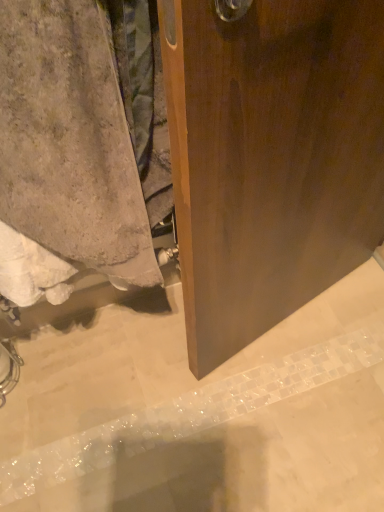
Question: Considering the positions of point (350, 359) and point (130, 181), is point (350, 359) closer or farther from the camera than point (130, 181)?

Choices:
 (A) closer
 (B) farther

Answer: (B)

Question: In the image, is gray concrete at lower left positioned in front of or behind beige textured towel at lower left?

Choices:
 (A) behind
 (B) front

Answer: (A)

Question: Considering the positions of gray concrete at lower left and beige textured towel at lower left in the image, is gray concrete at lower left bigger or smaller than beige textured towel at lower left?

Choices:
 (A) big
 (B) small

Answer: (B)

Question: Considering the positions of beige textured towel at lower left and gray concrete at lower left in the image, is beige textured towel at lower left wider or thinner than gray concrete at lower left?

Choices:
 (A) wide
 (B) thin

Answer: (B)

Question: Considering the relative positions of beige textured towel at lower left and gray concrete at lower left in the image provided, is beige textured towel at lower left to the left or to the right of gray concrete at lower left?

Choices:
 (A) left
 (B) right

Answer: (A)

Question: From the image's perspective, is beige textured towel at lower left above or below gray concrete at lower left?

Choices:
 (A) below
 (B) above

Answer: (B)

Question: Relative to gray concrete at lower left, is beige textured towel at lower left in front or behind?

Choices:
 (A) behind
 (B) front

Answer: (B)